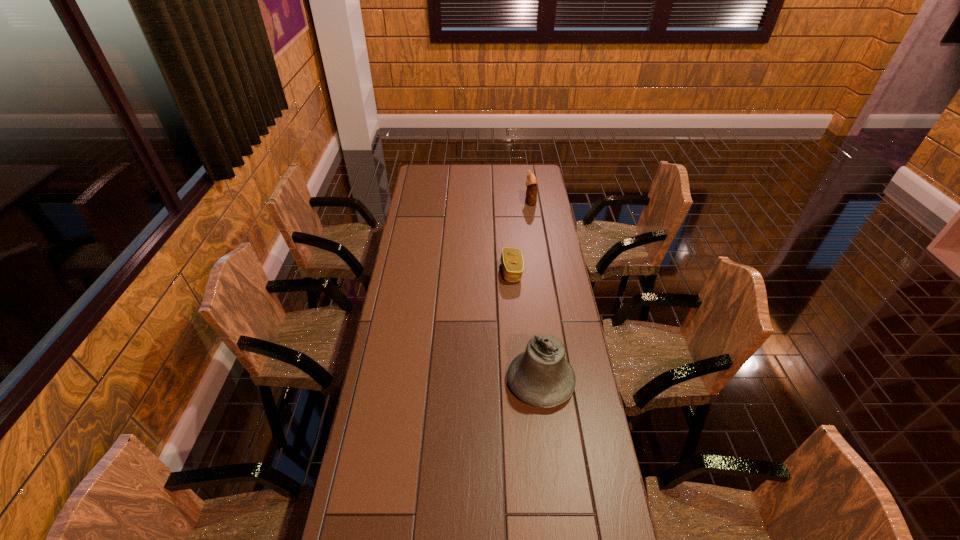
The image size is (960, 540). What are the coordinates of `vacant position located on the zipper side of the nearer clutch bag` in the screenshot? It's located at (447, 272).

Identify the location of free space located on the zipper side of the nearer clutch bag. This screenshot has width=960, height=540. (416, 272).

This screenshot has width=960, height=540. I want to click on vacant area located on the zipper side of the nearer clutch bag, so click(420, 272).

Image resolution: width=960 pixels, height=540 pixels. What are the coordinates of `bell located in the right edge section of the desktop` in the screenshot? It's located at (541, 376).

Identify the location of clutch bag that is at the right edge. The width and height of the screenshot is (960, 540). (531, 182).

This screenshot has height=540, width=960. Find the location of `free location at the far edge`. free location at the far edge is located at coordinates (469, 181).

I want to click on vacant space at the left edge of the desktop, so click(x=426, y=226).

In the image, there is a desktop. Identify the location of vacant space at the right edge. (564, 275).

Where is `free spot at the far right corner of the desktop`? free spot at the far right corner of the desktop is located at coordinates (531, 170).

Where is `free point between the tallest object and the farther clutch bag`? Image resolution: width=960 pixels, height=540 pixels. free point between the tallest object and the farther clutch bag is located at coordinates (536, 292).